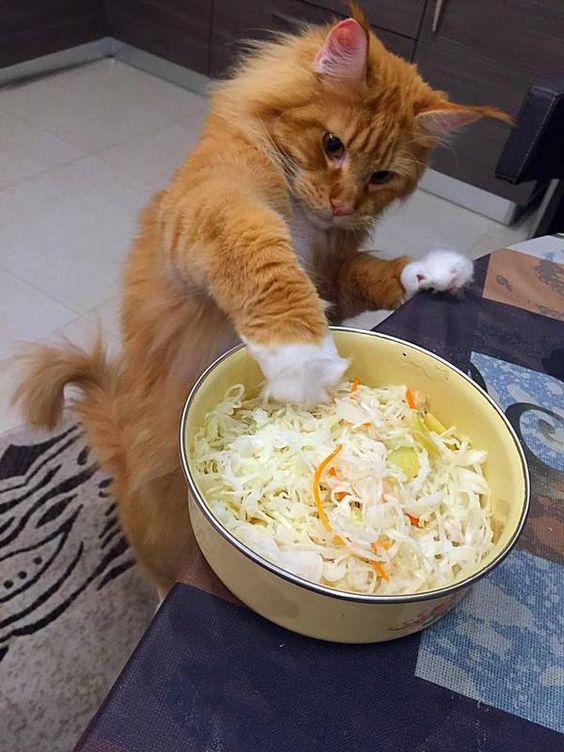
The height and width of the screenshot is (752, 564). I want to click on blue mats, so click(x=504, y=674), click(x=539, y=422).